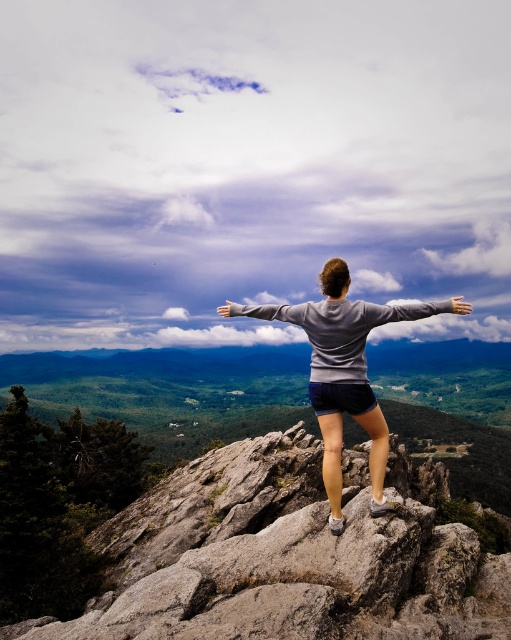
Question: Which point is farther from the camera taking this photo?

Choices:
 (A) (319, 387)
 (B) (469, 310)

Answer: (A)

Question: Can you confirm if gray rock at center is smaller than gray matte sweatshirt at center?

Choices:
 (A) no
 (B) yes

Answer: (A)

Question: Which object is farther from the camera taking this photo?

Choices:
 (A) gray sweatshirt at upper center
 (B) gray sweatshirt at center
 (C) gray rock at center
 (D) gray matte sweatshirt at center

Answer: (B)

Question: Is gray rock at center below white matte hand at upper center?

Choices:
 (A) no
 (B) yes

Answer: (B)

Question: Which point is closer to the camera?

Choices:
 (A) white matte hand at upper center
 (B) gray matte hand at center
 (C) gray sweatshirt at upper center
 (D) gray matte sweatshirt at center

Answer: (D)

Question: Can you confirm if white matte hand at upper center is positioned above gray matte hand at center?

Choices:
 (A) yes
 (B) no

Answer: (A)